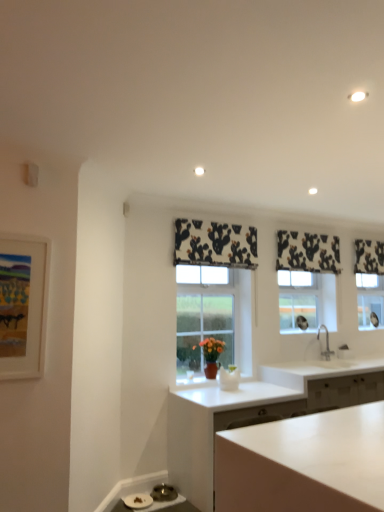
What are the coordinates of `vacant region above white matte cabinet at center (from a real-world perspective)` in the screenshot? It's located at (251, 387).